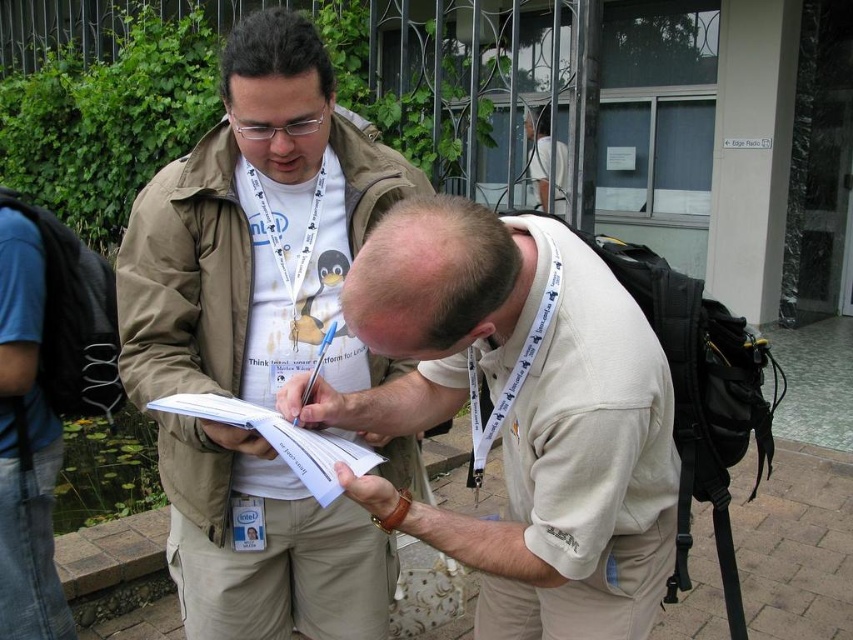
Can you confirm if khaki pants at center is positioned to the left of blue denim jeans at lower left?

No, khaki pants at center is not to the left of blue denim jeans at lower left.

Can you confirm if khaki pants at center is wider than blue denim jeans at lower left?

Correct, the width of khaki pants at center exceeds that of blue denim jeans at lower left.

Which is behind, point (235, 244) or point (39, 339)?

The point (39, 339) is more distant.

The height and width of the screenshot is (640, 853). Find the location of `khaki pants at center`. khaki pants at center is located at coordinates (252, 225).

Can you confirm if khaki pants at center is thinner than white paper at center?

In fact, khaki pants at center might be wider than white paper at center.

Based on the photo, is khaki pants at center to the left of white paper at center from the viewer's perspective?

In fact, khaki pants at center is to the right of white paper at center.

Does point (314, 616) come in front of point (312, 470)?

No, it is behind (312, 470).

The height and width of the screenshot is (640, 853). Find the location of `khaki pants at center`. khaki pants at center is located at coordinates (252, 225).

Measure the distance between point (325, 544) and camera.

Point (325, 544) and camera are 1.76 meters apart.

This screenshot has height=640, width=853. What do you see at coordinates (252, 225) in the screenshot?
I see `khaki pants at center` at bounding box center [252, 225].

The height and width of the screenshot is (640, 853). Identify the location of khaki pants at center. (252, 225).